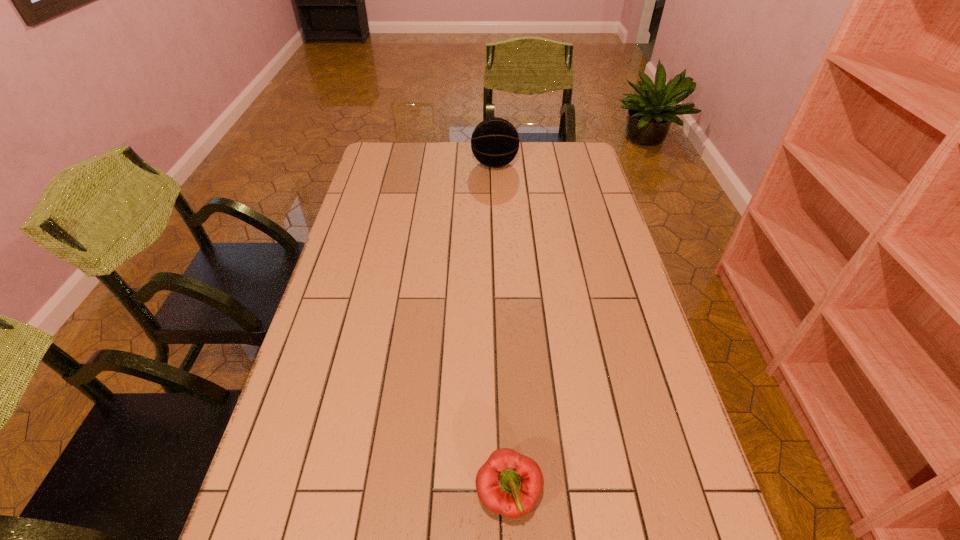
Image resolution: width=960 pixels, height=540 pixels. What are the coordinates of `the farther object` in the screenshot? It's located at (495, 142).

You are a GUI agent. You are given a task and a screenshot of the screen. Output one action in this format:
    pyautogui.click(x=<x>, y=<y>)
    Task: Click on the basketball
    The width and height of the screenshot is (960, 540).
    Given the screenshot: What is the action you would take?
    pyautogui.click(x=495, y=142)

At what (x,y) coordinates should I click in order to perform the action: click on the nearer object. Please return your answer as a coordinate pair (x, y). Looking at the image, I should click on (508, 483).

This screenshot has height=540, width=960. Identify the location of bell pepper. (508, 483).

Find the location of a particular element. vacant area located 0.120m on the left of the taller object is located at coordinates (442, 164).

The width and height of the screenshot is (960, 540). I want to click on blank space located on the back of the bell pepper, so click(502, 357).

Locate an element on the screen. The width and height of the screenshot is (960, 540). object that is positioned at the far edge is located at coordinates (495, 142).

Locate an element on the screen. free region at the far edge of the desktop is located at coordinates (437, 161).

The image size is (960, 540). I want to click on free region at the left edge, so click(298, 469).

In the image, there is a desktop. Where is `vacant space at the right edge`? vacant space at the right edge is located at coordinates pos(608,222).